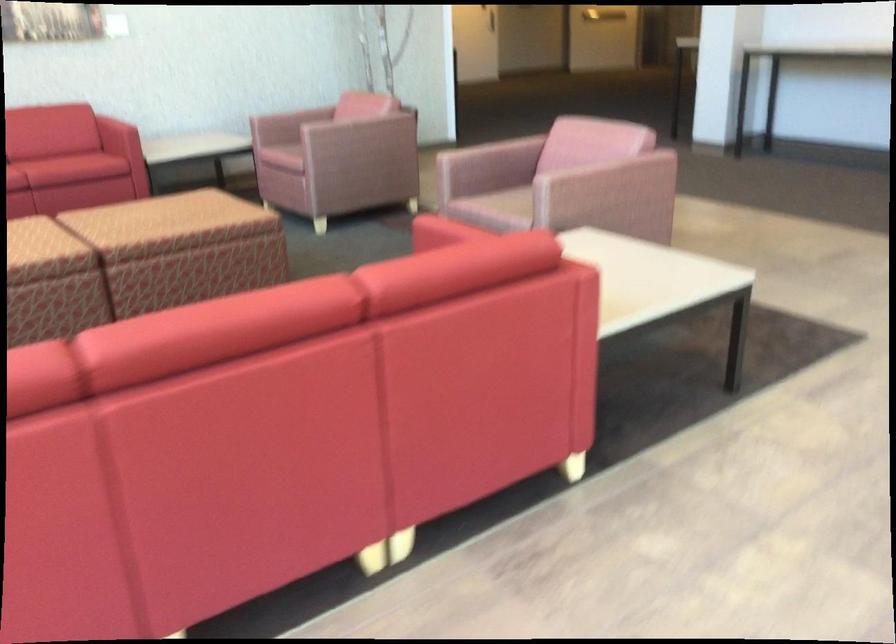
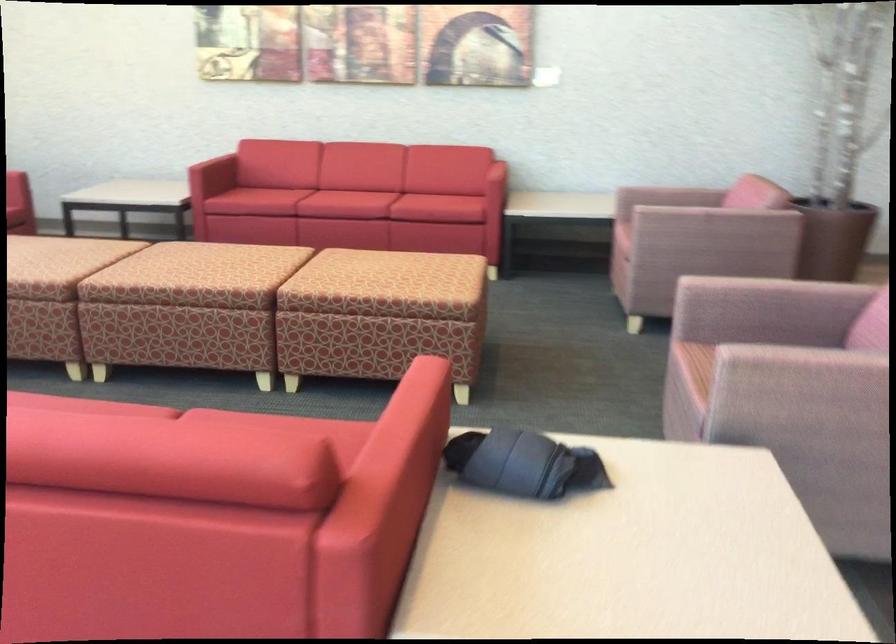
In the second image, find the point that corresponds to point (468, 254) in the first image.

(173, 442)